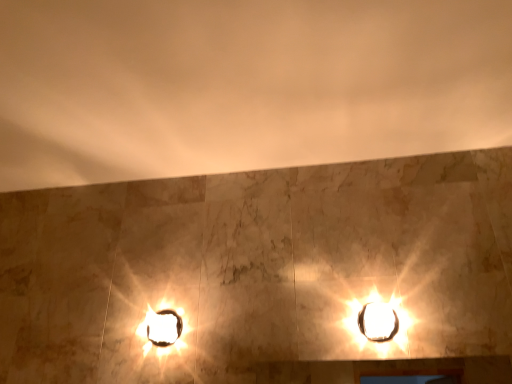
What do you see at coordinates (378, 322) in the screenshot? I see `matte glass lamp at upper right` at bounding box center [378, 322].

Image resolution: width=512 pixels, height=384 pixels. I want to click on matte glass lamp at upper right, so click(x=378, y=322).

What do you see at coordinates (163, 327) in the screenshot? I see `white glossy stage light at lower left` at bounding box center [163, 327].

In order to face white glossy stage light at lower left, should I rotate leftwards or rightwards?

Rotate your view left by about 12.460°.

You are a GUI agent. You are given a task and a screenshot of the screen. Output one action in this format:
    pyautogui.click(x=<x>, y=<y>)
    Task: Click on the white glossy stage light at lower left
    Image resolution: width=512 pixels, height=384 pixels.
    Given the screenshot: What is the action you would take?
    pyautogui.click(x=163, y=327)

I want to click on matte glass lamp at upper right, so click(x=378, y=322).

Consider the image. Considering the relative positions of matte glass lamp at upper right and white glossy stage light at lower left in the image provided, is matte glass lamp at upper right to the right of white glossy stage light at lower left from the viewer's perspective?

Yes, matte glass lamp at upper right is to the right of white glossy stage light at lower left.

In the image, is matte glass lamp at upper right positioned in front of or behind white glossy stage light at lower left?

matte glass lamp at upper right is positioned closer to the viewer than white glossy stage light at lower left.

Does point (383, 332) come in front of point (172, 331)?

That is True.

From the image's perspective, is matte glass lamp at upper right above white glossy stage light at lower left?

Yes.

In the scene shown: From a real-world perspective, does matte glass lamp at upper right stand above white glossy stage light at lower left?

Yes, from a real-world perspective, matte glass lamp at upper right is on top of white glossy stage light at lower left.

Is matte glass lamp at upper right wider than white glossy stage light at lower left?

Yes.

Does matte glass lamp at upper right have a lesser height compared to white glossy stage light at lower left?

No, matte glass lamp at upper right is not shorter than white glossy stage light at lower left.

In the scene shown: Looking at the image, does matte glass lamp at upper right seem bigger or smaller compared to white glossy stage light at lower left?

In the image, matte glass lamp at upper right appears to be larger than white glossy stage light at lower left.

Is matte glass lamp at upper right inside the boundaries of white glossy stage light at lower left, or outside?

matte glass lamp at upper right is not inside white glossy stage light at lower left, it's outside.

Would you say matte glass lamp at upper right is a long distance from white glossy stage light at lower left?

No, matte glass lamp at upper right is not far away from white glossy stage light at lower left.

Is matte glass lamp at upper right aimed at white glossy stage light at lower left?

No, matte glass lamp at upper right is not oriented towards white glossy stage light at lower left.

How many degrees apart are the facing directions of matte glass lamp at upper right and white glossy stage light at lower left?

The angular difference between matte glass lamp at upper right and white glossy stage light at lower left is 0.154 degrees.

The image size is (512, 384). In order to click on stage light behind the matte glass lamp at upper right in this screenshot , I will do `click(163, 327)`.

Which object is positioned more to the left, white glossy stage light at lower left or matte glass lamp at upper right?

Positioned to the left is white glossy stage light at lower left.

Is white glossy stage light at lower left positioned in front of matte glass lamp at upper right?

No, it is behind matte glass lamp at upper right.

Is point (147, 337) closer to camera compared to point (375, 306)?

No, (147, 337) is further to viewer.

From the image's perspective, is white glossy stage light at lower left on matte glass lamp at upper right?

No, from the image's perspective, white glossy stage light at lower left is not on top of matte glass lamp at upper right.

In the scene shown: From a real-world perspective, is white glossy stage light at lower left positioned above or below matte glass lamp at upper right?

In terms of real-world spatial position, white glossy stage light at lower left is below matte glass lamp at upper right.

Between white glossy stage light at lower left and matte glass lamp at upper right, which one has smaller width?

white glossy stage light at lower left is thinner.

Between white glossy stage light at lower left and matte glass lamp at upper right, which one has more height?

Standing taller between the two is matte glass lamp at upper right.

Considering the sizes of objects white glossy stage light at lower left and matte glass lamp at upper right in the image provided, who is bigger, white glossy stage light at lower left or matte glass lamp at upper right?

With larger size is matte glass lamp at upper right.

Is matte glass lamp at upper right completely or partially inside white glossy stage light at lower left?

No, matte glass lamp at upper right is not a part of white glossy stage light at lower left.

Is there a large distance between white glossy stage light at lower left and matte glass lamp at upper right?

No, white glossy stage light at lower left is not far away from matte glass lamp at upper right.

Could you tell me if white glossy stage light at lower left is turned towards matte glass lamp at upper right?

No, white glossy stage light at lower left is not oriented towards matte glass lamp at upper right.

How distant is white glossy stage light at lower left from matte glass lamp at upper right?

white glossy stage light at lower left is 23.45 inches from matte glass lamp at upper right.

This screenshot has height=384, width=512. I want to click on stage light on the left of matte glass lamp at upper right, so click(163, 327).

The image size is (512, 384). I want to click on lamp on the right of white glossy stage light at lower left, so click(378, 322).

This screenshot has width=512, height=384. I want to click on stage light below the matte glass lamp at upper right (from a real-world perspective), so click(163, 327).